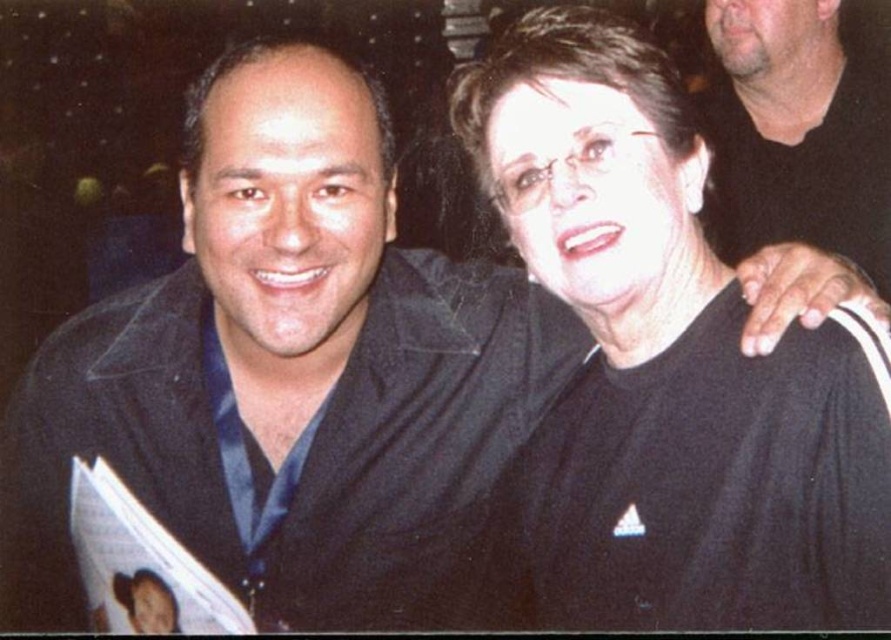
Which is behind, point (624, 604) or point (722, 164)?

The point (722, 164) is more distant.

Where is `black matte shirt at center`? This screenshot has width=891, height=640. black matte shirt at center is located at coordinates (666, 364).